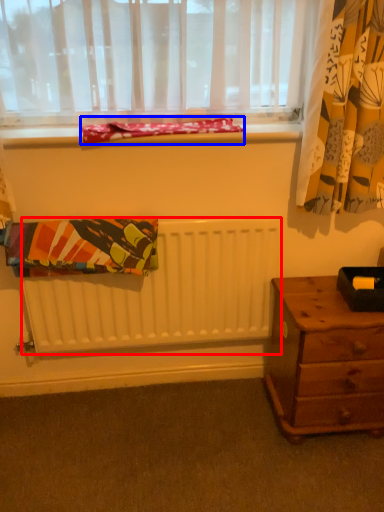
Question: Which of the following is the closest to the observer, radiator (highlighted by a red box) or blanket (highlighted by a blue box)?

Choices:
 (A) radiator
 (B) blanket

Answer: (B)